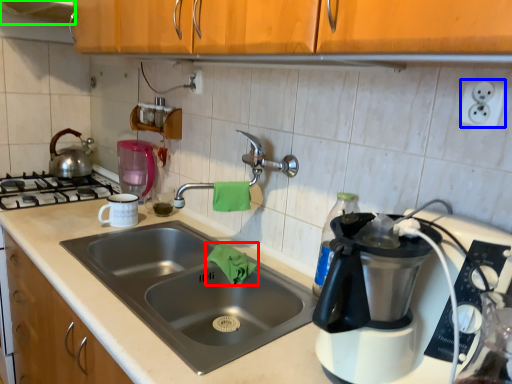
Question: Which object is the farthest from material (highlighted by a red box)? Choose among these: electric outlet (highlighted by a blue box) or exhaust hood (highlighted by a green box).

Choices:
 (A) electric outlet
 (B) exhaust hood

Answer: (B)